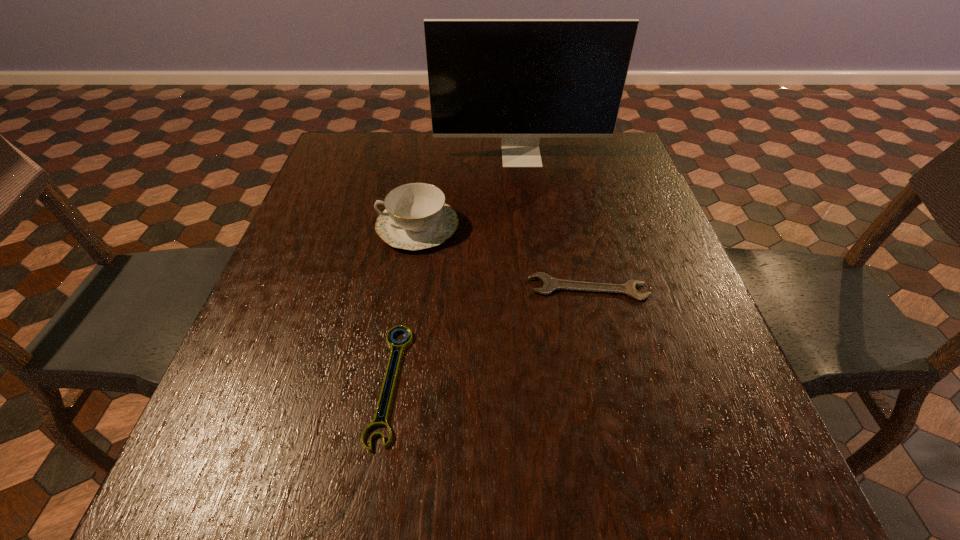
Locate an element on the screen. Image resolution: width=960 pixels, height=540 pixels. vacant area that lies between the third shortest object and the farther wrench is located at coordinates (503, 257).

Identify the location of vacant space that is in between the third farthest object and the farthest object. (555, 222).

Select which object is the third closest to the right wrench. Please provide its 2D coordinates. Your answer should be formatted as a tuple, i.e. [(x, y)], where the tuple contains the x and y coordinates of a point satisfying the conditions above.

[(520, 80)]

Locate which object is the second closest to the nearest object. Please provide its 2D coordinates. Your answer should be formatted as a tuple, i.e. [(x, y)], where the tuple contains the x and y coordinates of a point satisfying the conditions above.

[(550, 284)]

The image size is (960, 540). In order to click on free location that satisfies the following two spatial constraints: 1. on the front-facing side of the tallest object; 2. on the handle side of the chinaware in this screenshot , I will do `click(530, 227)`.

Identify the location of vacant space that satisfies the following two spatial constraints: 1. on the handle side of the chinaware; 2. on the left side of the third farthest object. Image resolution: width=960 pixels, height=540 pixels. (409, 288).

Identify the location of free point that satisfies the following two spatial constraints: 1. on the front-facing side of the right wrench; 2. on the left side of the monitor. The image size is (960, 540). (538, 288).

The width and height of the screenshot is (960, 540). Find the location of `vacant area that satisfies the following two spatial constraints: 1. on the handle side of the second tallest object; 2. on the back side of the third tallest object`. vacant area that satisfies the following two spatial constraints: 1. on the handle side of the second tallest object; 2. on the back side of the third tallest object is located at coordinates click(x=409, y=288).

At what (x,y) coordinates should I click in order to perform the action: click on free space that satisfies the following two spatial constraints: 1. on the back side of the nearer wrench; 2. on the left side of the right wrench. Please return your answer as a coordinate pair (x, y). Looking at the image, I should click on (405, 288).

The image size is (960, 540). I want to click on free space that satisfies the following two spatial constraints: 1. on the handle side of the right wrench; 2. on the left side of the second farthest object, so click(409, 288).